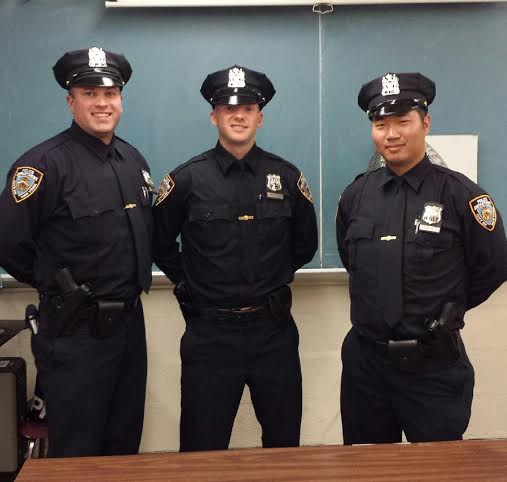
The height and width of the screenshot is (482, 507). Find the location of `wooden desk`. wooden desk is located at coordinates (300, 472).